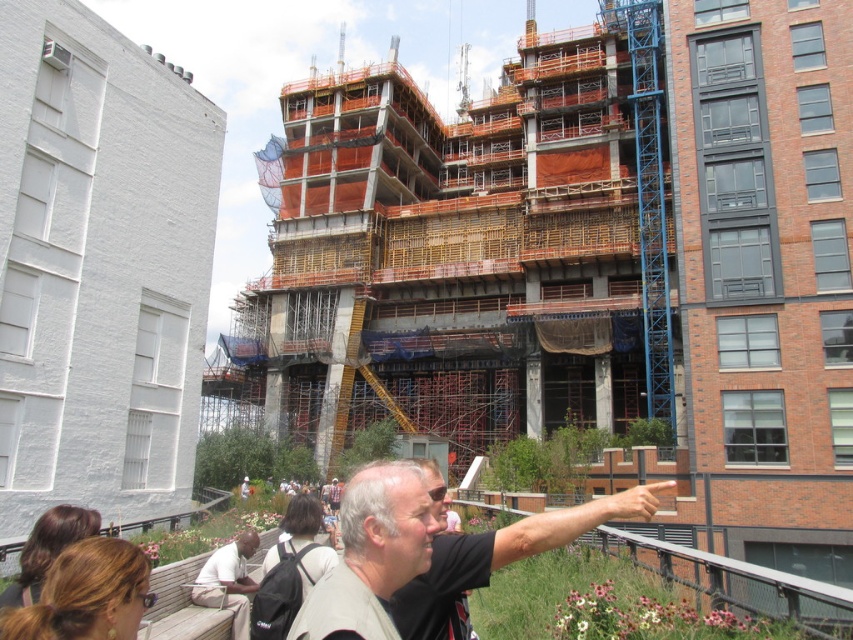
Question: Is light beige shirt at center bigger than light brown leather jacket at lower left?

Choices:
 (A) no
 (B) yes

Answer: (B)

Question: Is gray fabric shirt at center smaller than light brown leather jacket at lower left?

Choices:
 (A) no
 (B) yes

Answer: (A)

Question: Which point is closer to the camera?

Choices:
 (A) (227, 605)
 (B) (605, 502)
 (C) (384, 628)

Answer: (C)

Question: Is light beige shirt at center wider than light brown leather jacket at lower left?

Choices:
 (A) no
 (B) yes

Answer: (B)

Question: Which object is the farthest from the light brown leather jacket at lower left?

Choices:
 (A) gray fabric shirt at center
 (B) light beige shirt at center

Answer: (A)

Question: Based on their relative distances, which object is nearer to the light beige shirt at center?

Choices:
 (A) light brown leather jacket at lower left
 (B) gray fabric shirt at center

Answer: (B)